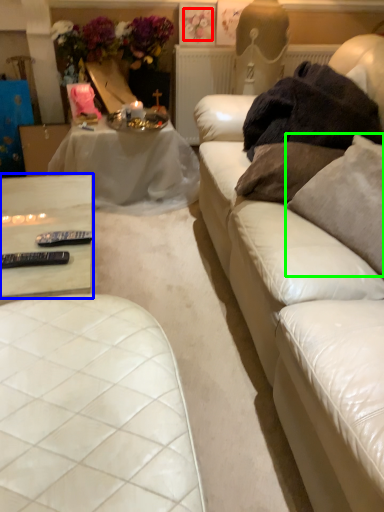
Question: Estimate the real-world distances between objects in this image. Which object is farther from flower (highlighted by a red box), table (highlighted by a blue box) or pillow (highlighted by a green box)?

Choices:
 (A) table
 (B) pillow

Answer: (B)